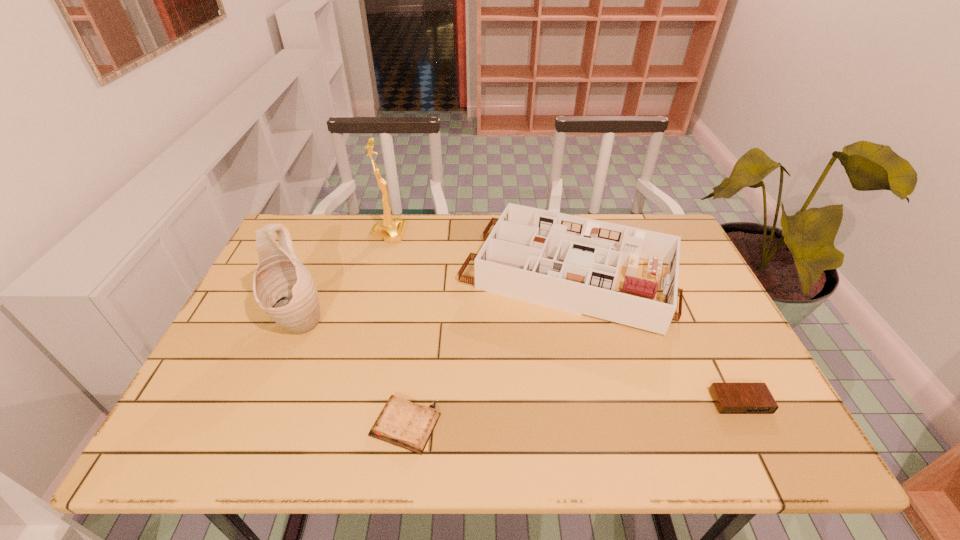
What are the coordinates of `vacant space at the left edge` in the screenshot? It's located at (252, 339).

This screenshot has width=960, height=540. Find the location of `vacant space at the right edge of the desktop`. vacant space at the right edge of the desktop is located at coordinates (706, 287).

I want to click on free space at the far left corner of the desktop, so click(301, 229).

This screenshot has width=960, height=540. I want to click on free space between the fourth tallest object and the second object from left to right, so click(x=564, y=318).

Locate an element on the screen. This screenshot has height=540, width=960. free space between the dollhouse and the alarm clock is located at coordinates (654, 338).

Where is `unoccupied area between the dollhouse and the leftmost object`? The image size is (960, 540). unoccupied area between the dollhouse and the leftmost object is located at coordinates (433, 298).

Find the location of a particular element. The image size is (960, 540). free space between the dollhouse and the award is located at coordinates (478, 254).

This screenshot has height=540, width=960. I want to click on vacant space in between the alarm clock and the award, so (x=564, y=318).

The width and height of the screenshot is (960, 540). Identify the location of vacant point located between the alarm clock and the leftmost object. (520, 361).

Where is `free spot between the alarm clock and the diary`? free spot between the alarm clock and the diary is located at coordinates (573, 414).